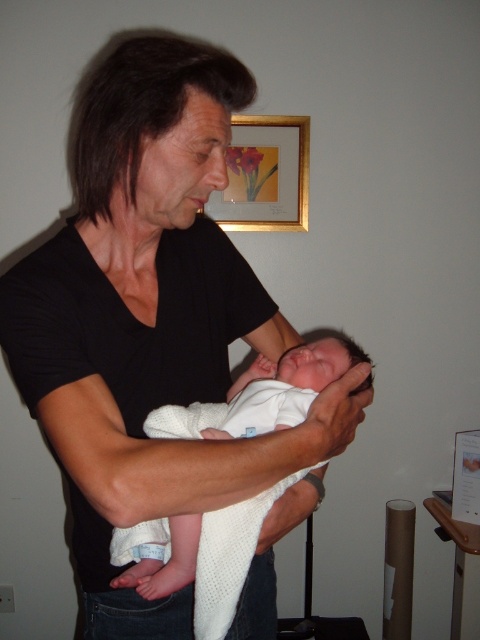
You are a photographer setting up for a photoshoot. You have a black matte shirt at center and a white knitted cloth at center in the scene. Which item should you adjust if you want to ensure the smaller object is fully visible without overlapping?

The white knitted cloth at center is smaller than the black matte shirt at center. To ensure the smaller object is fully visible without overlapping, adjust the position of the black matte shirt at center since it is larger and might cover the smaller white knitted cloth at center.